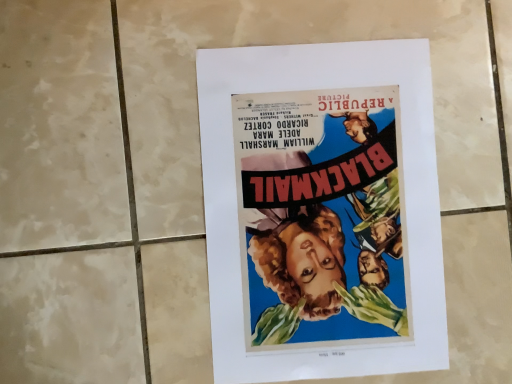
Identify the location of vacant space situated above vibrant paper poster at center (from a real-world perspective). The width and height of the screenshot is (512, 384). (324, 215).